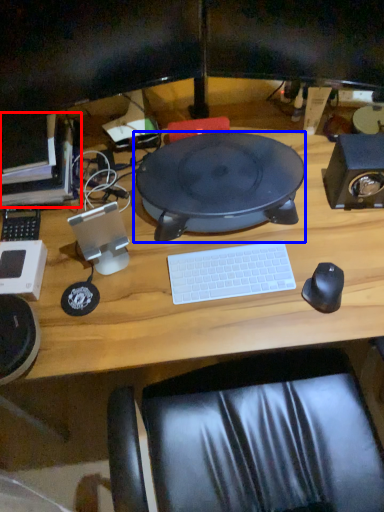
Question: Which of the following is the farthest to the observer, computer (highlighted by a red box) or sit (highlighted by a blue box)?

Choices:
 (A) computer
 (B) sit

Answer: (A)